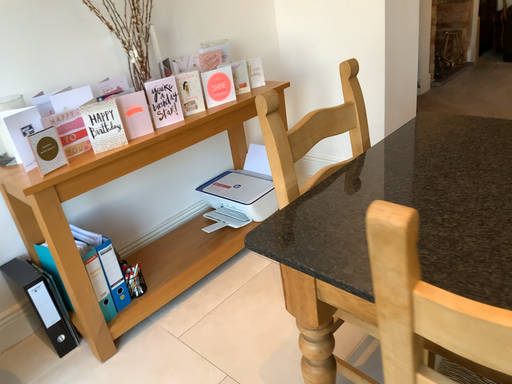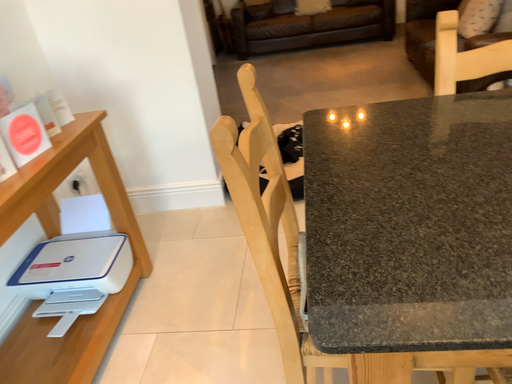
Question: How did the camera likely rotate when shooting the video?

Choices:
 (A) rotated right
 (B) rotated left

Answer: (A)